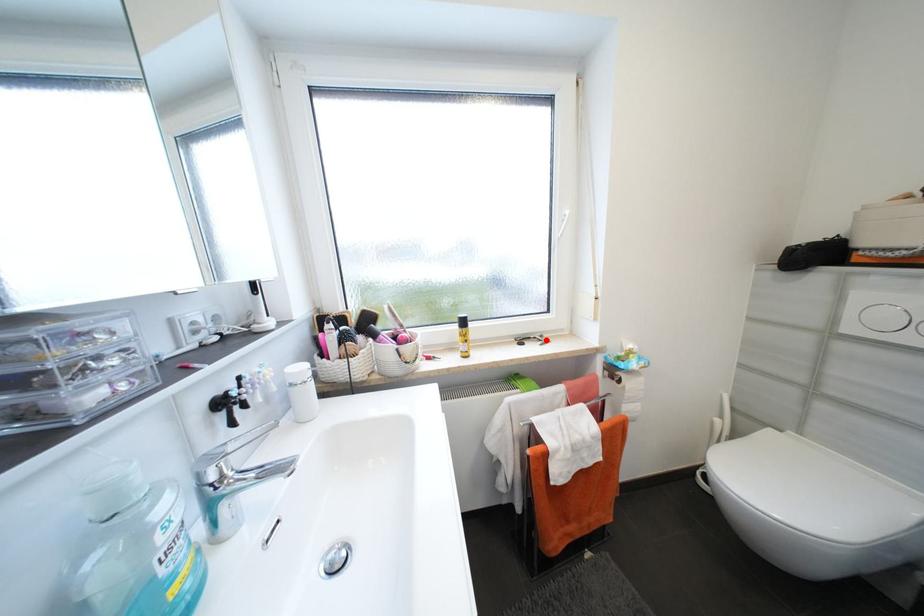
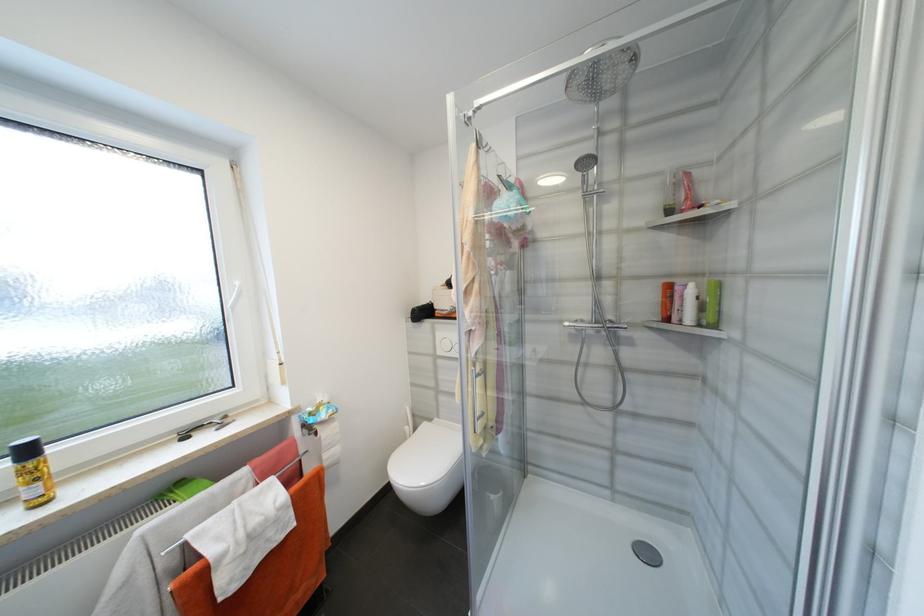
The point at the highlighted location is marked in the first image. Where is the corresponding point in the second image?

(228, 422)